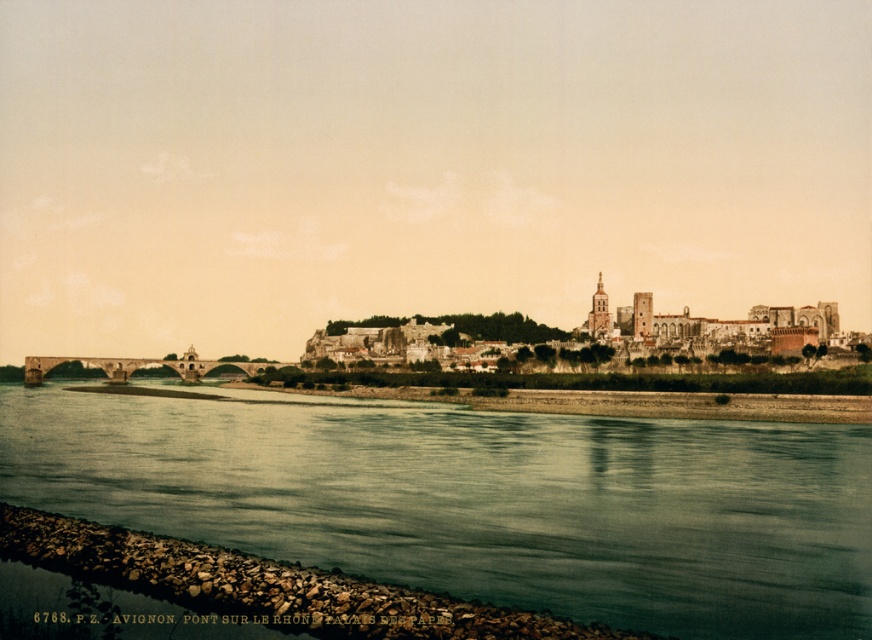
Question: Which of the following is the farthest from the observer?

Choices:
 (A) brown/smooth river at lower center
 (B) brown stone buildings at center

Answer: (B)

Question: Which point is farther to the camera?

Choices:
 (A) (680, 337)
 (B) (595, 596)

Answer: (A)

Question: Can you confirm if brown/smooth river at lower center is positioned below brown stone buildings at center?

Choices:
 (A) no
 (B) yes

Answer: (B)

Question: Where is brown/smooth river at lower center located in relation to brown stone buildings at center in the image?

Choices:
 (A) below
 (B) above

Answer: (A)

Question: Which object appears farthest from the camera in this image?

Choices:
 (A) brown stone buildings at center
 (B) brown/smooth river at lower center

Answer: (A)

Question: Is brown/smooth river at lower center below brown stone buildings at center?

Choices:
 (A) yes
 (B) no

Answer: (A)